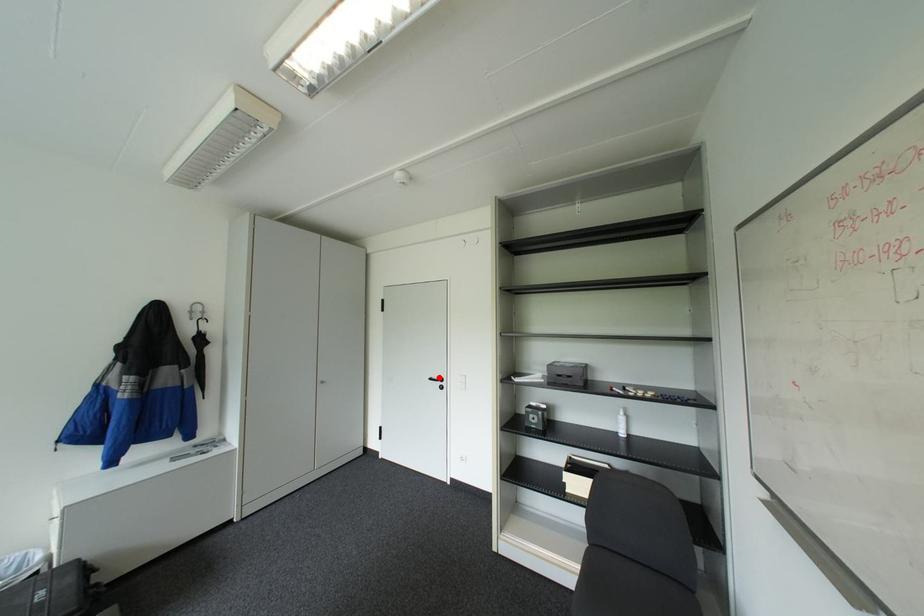
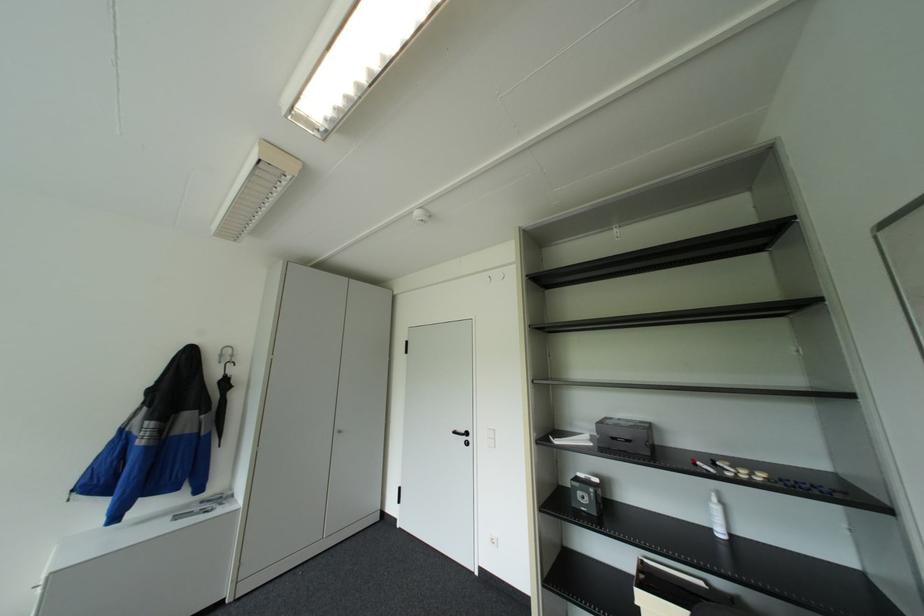
In the second image, find the point that corresponds to the highlighted location in the first image.

(463, 431)